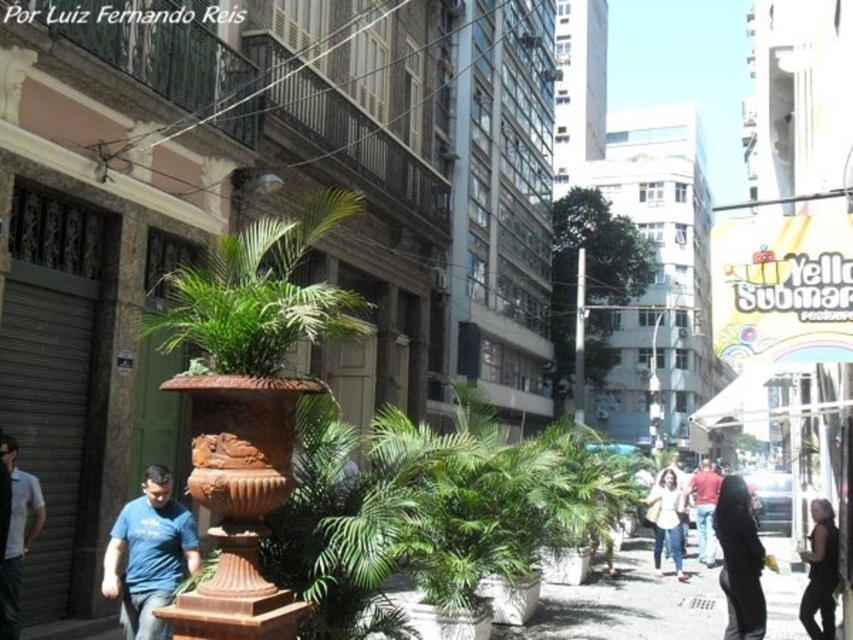
Does blue t-shirt at center have a lesser width compared to light blue shirt at lower left?

In fact, blue t-shirt at center might be wider than light blue shirt at lower left.

Does point (160, 497) lie behind point (7, 596)?

No.

The width and height of the screenshot is (853, 640). I want to click on blue t-shirt at center, so click(x=149, y=556).

Is dark gray fabric jacket at lower right positioned in front of matte red shirt at center?

That is True.

Does dark gray fabric jacket at lower right have a smaller size compared to matte red shirt at center?

No, dark gray fabric jacket at lower right is not smaller than matte red shirt at center.

Which is behind, point (732, 584) or point (694, 480)?

Point (694, 480)

Locate an element on the screen. The width and height of the screenshot is (853, 640). dark gray fabric jacket at lower right is located at coordinates (740, 561).

Describe the element at coordinates (820, 572) in the screenshot. I see `black leather jacket at lower right` at that location.

Where is `black leather jacket at lower right`? black leather jacket at lower right is located at coordinates (820, 572).